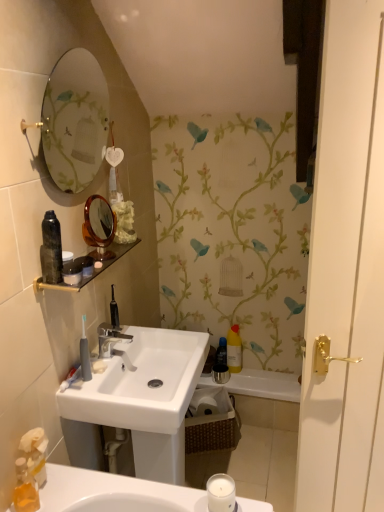
You are a GUI agent. You are given a task and a screenshot of the screen. Output one action in this format:
    pyautogui.click(x=<x>, y=<y>)
    Task: Click on the vacant area that is in front of yellow matte bottle at center, which appears as the 2th toiletry when viewed from the left
    Image resolution: width=384 pixels, height=512 pixels.
    Given the screenshot: What is the action you would take?
    pyautogui.click(x=252, y=381)